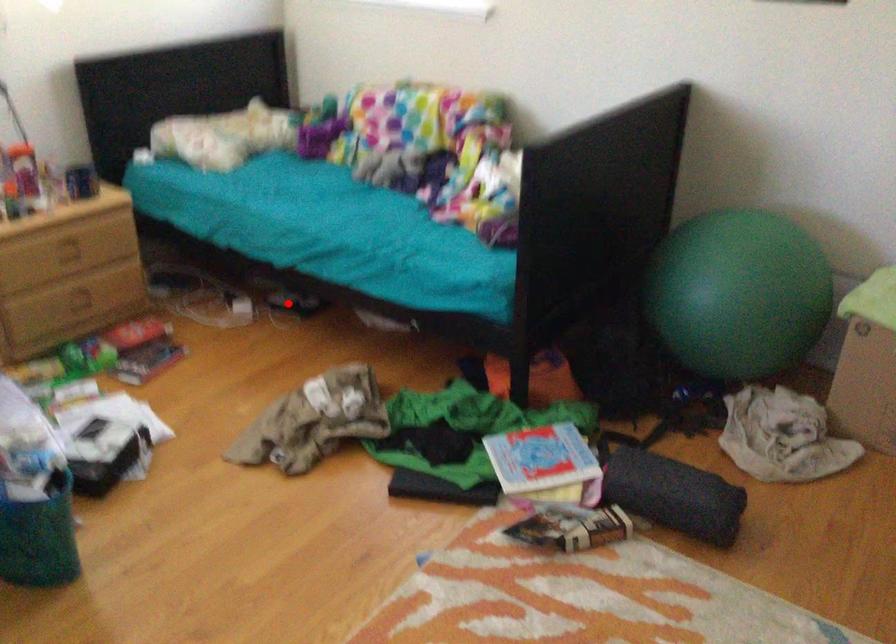
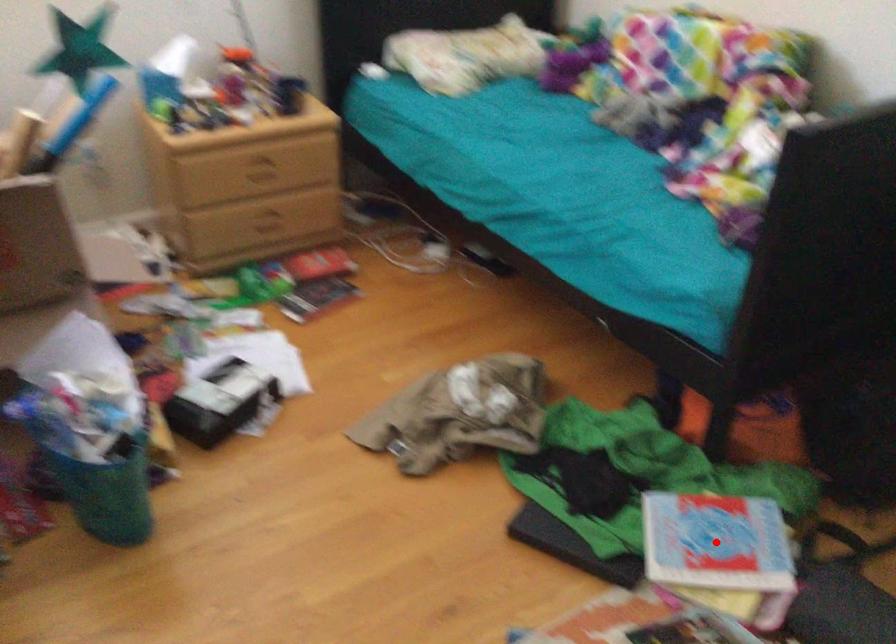
I am providing you with two images of the same scene from different viewpoints. A red point is marked on the first image and another point is marked on the second image. Do the highlighted points in image1 and image2 indicate the same real-world spot?

No